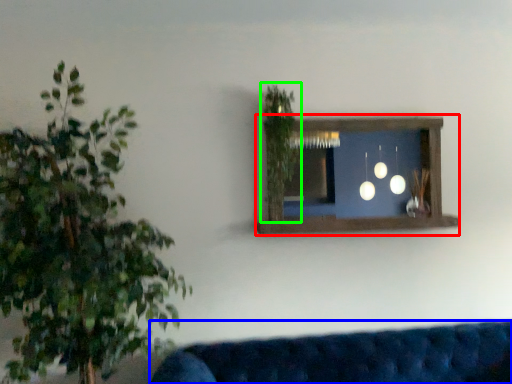
Question: Based on their relative distances, which object is farther from window frame (highlighted by a red box)? Choose from studio couch (highlighted by a blue box) and plant (highlighted by a green box).

Choices:
 (A) studio couch
 (B) plant

Answer: (A)